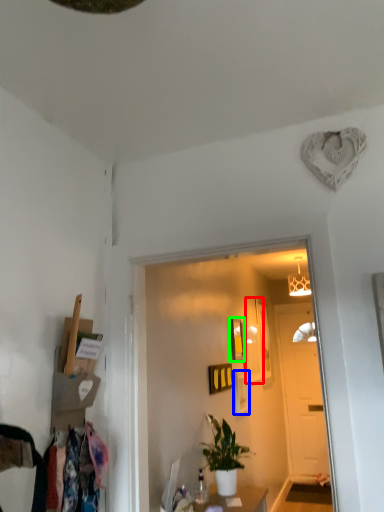
Question: Which object is the closest to the picture frame (highlighted by a red box)? Choose among these: picture frame (highlighted by a blue box) or picture frame (highlighted by a green box).

Choices:
 (A) picture frame
 (B) picture frame

Answer: (A)